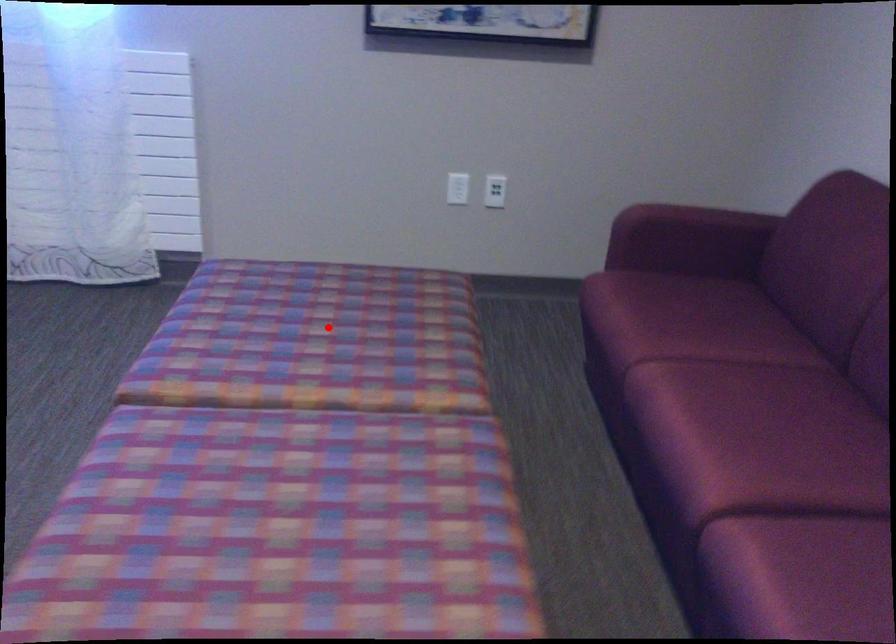
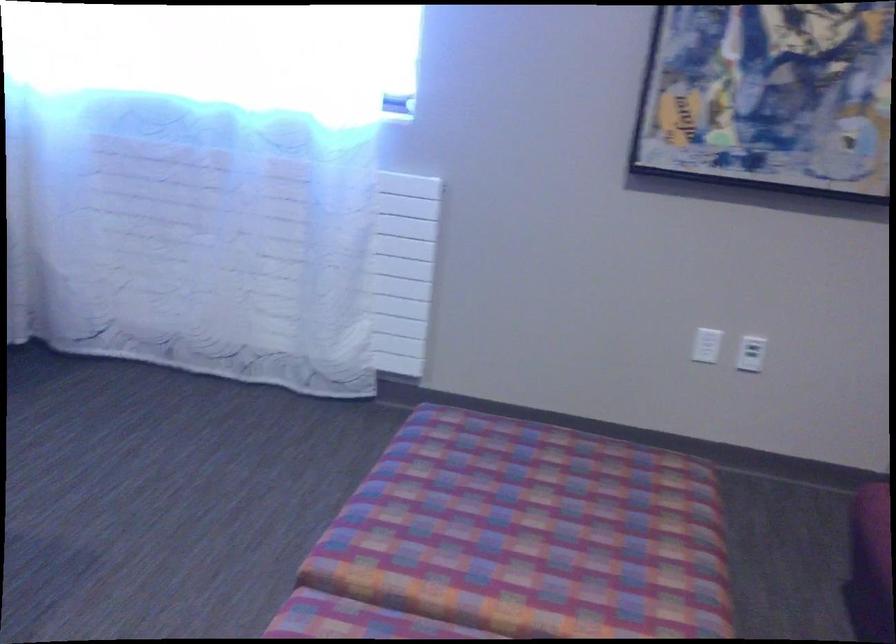
Question: I am providing you with two images of the same scene from different viewpoints. A red point is shown in image1. For the corresponding object point in image2, is it positioned nearer or farther from the camera?

Choices:
 (A) Nearer
 (B) Farther

Answer: (A)